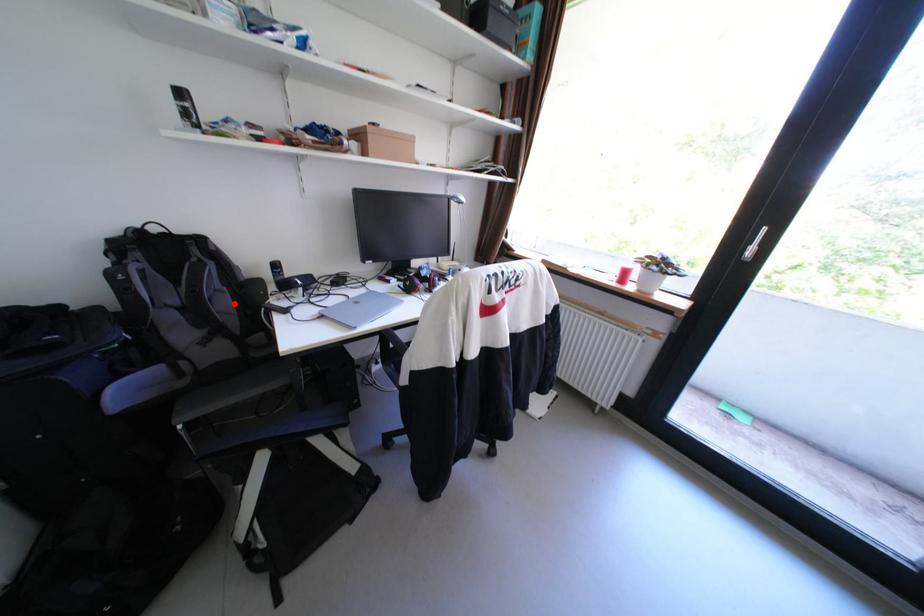
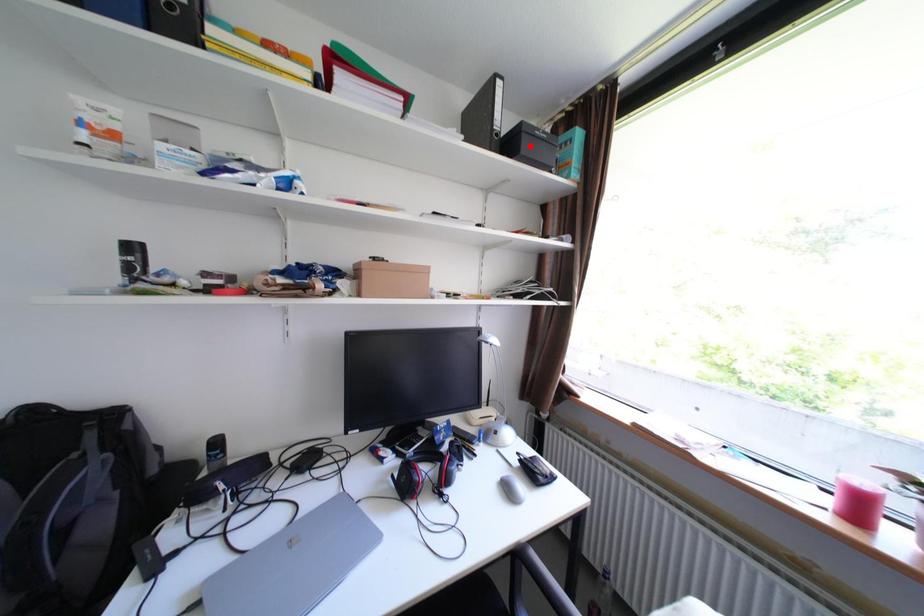
I am providing you with two images of the same scene from different viewpoints. A red point is marked on the first image and another point is marked on the second image. Is the red point in image1 aligned with the point shown in image2?

No